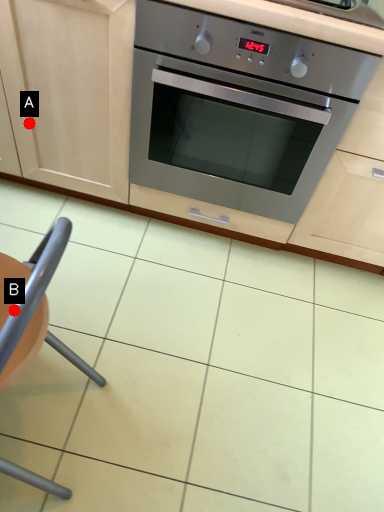
Question: Two points are circled on the image, labeled by A and B beside each circle. Which point appears closest to the camera in this image?

Choices:
 (A) A is closer
 (B) B is closer

Answer: (B)